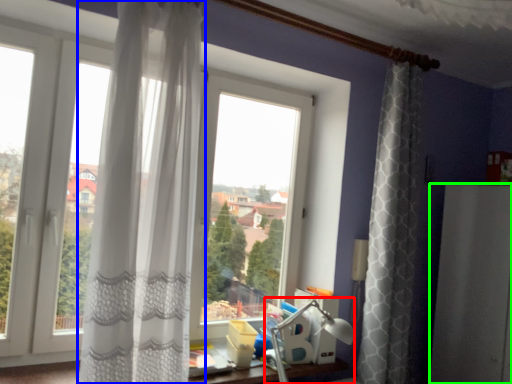
Question: Based on their relative distances, which object is nearer to table lamp (highlighted by a red box)? Choose from curtain (highlighted by a blue box) and screen door (highlighted by a green box).

Choices:
 (A) curtain
 (B) screen door

Answer: (B)